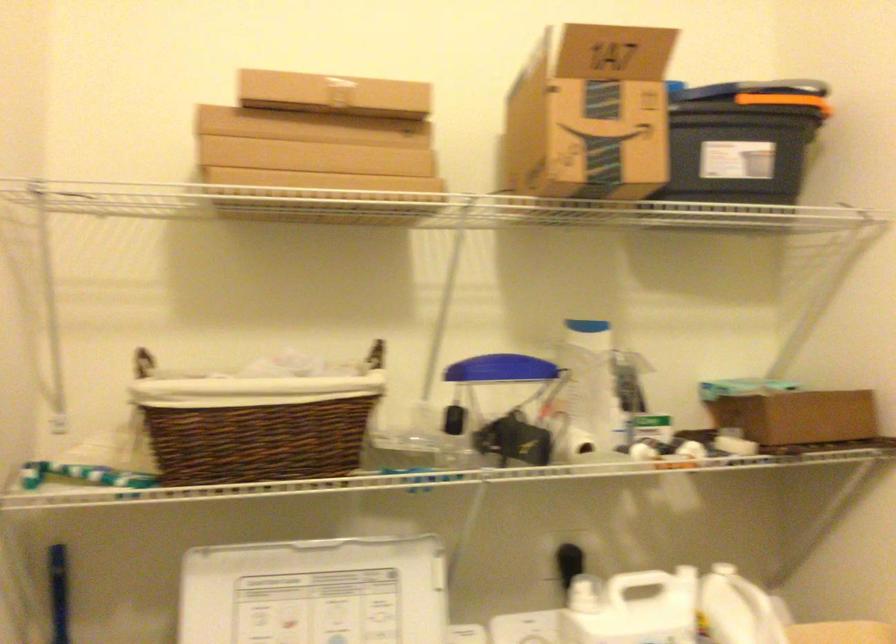
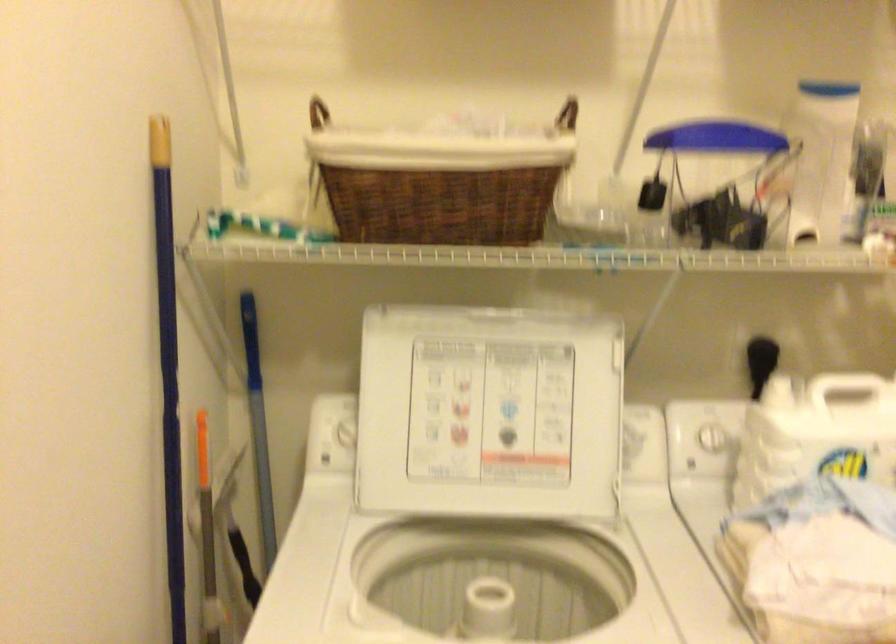
Where in the second image is the point corresponding to [588,386] from the first image?

(821, 158)